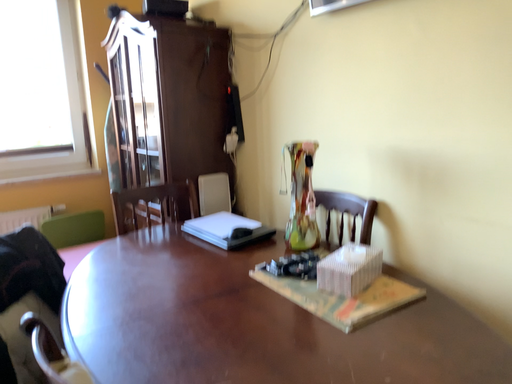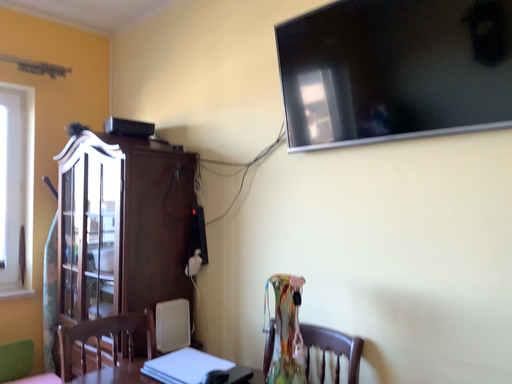
Question: Which way did the camera rotate in the video?

Choices:
 (A) rotated downward
 (B) rotated upward

Answer: (B)